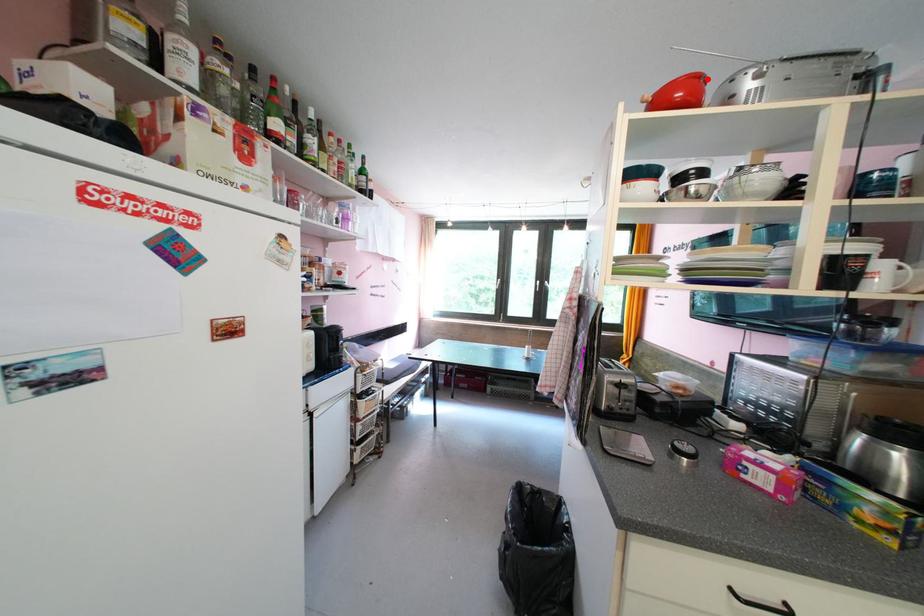
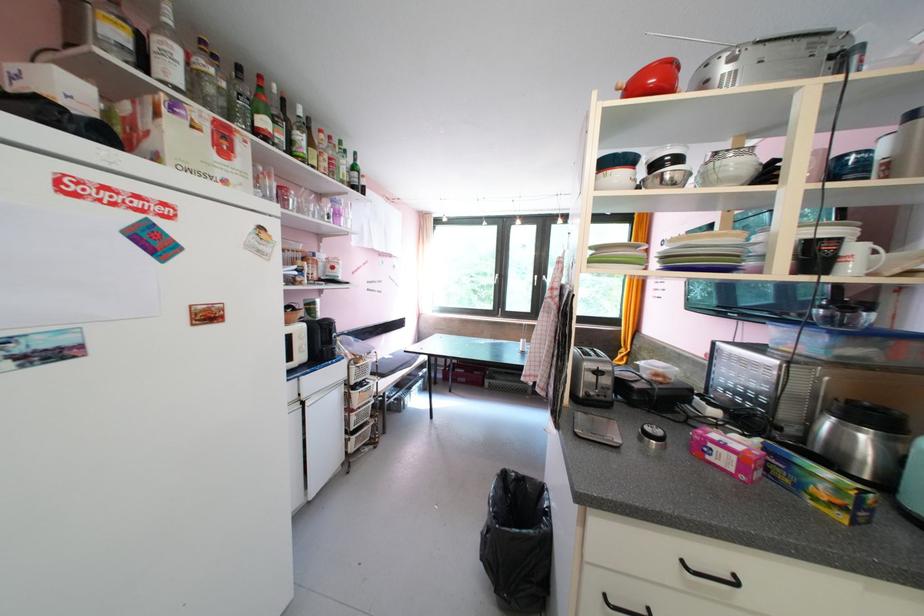
Where in the second image is the point corresponding to the highlighted location from the first image?

(678, 63)